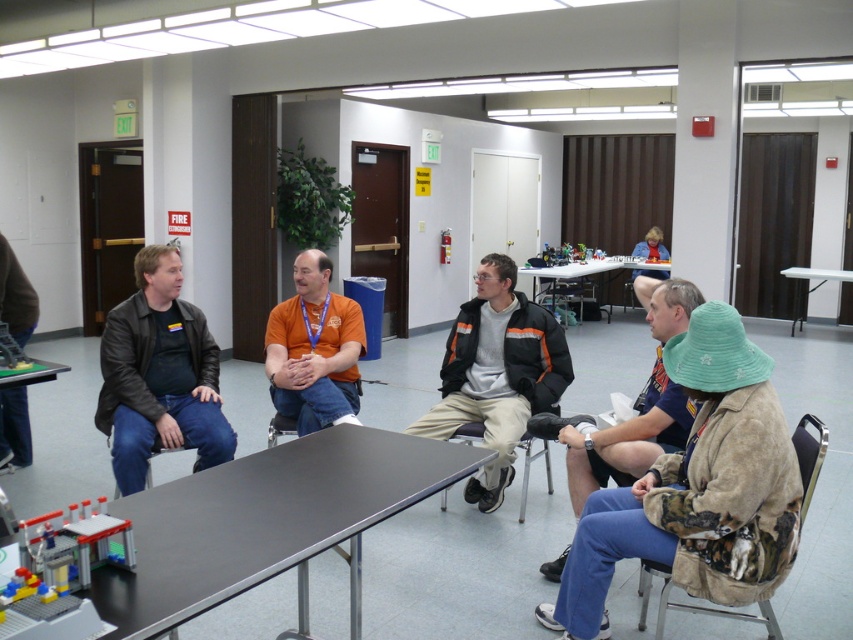
Question: Which object is the farthest from the orange jacket at center?

Choices:
 (A) multicolored plastic toys at center
 (B) translucent plastic toy at lower left
 (C) black fabric chair at center
 (D) white plastic table at right

Answer: (D)

Question: In this image, where is matte plastic chair at center located relative to multicolored plastic toys at center?

Choices:
 (A) below
 (B) above

Answer: (A)

Question: Which of these objects is positioned farthest from the leather jacket at left?

Choices:
 (A) matte plastic chair at lower left
 (B) white plastic table at center

Answer: (B)

Question: Does black metal table at lower left come in front of translucent plastic toy at lower left?

Choices:
 (A) yes
 (B) no

Answer: (A)

Question: Can you confirm if green plastic table at lower left is bigger than multicolored plastic toys at center?

Choices:
 (A) no
 (B) yes

Answer: (A)

Question: Which point appears farthest from the camera in this image?

Choices:
 (A) (804, 272)
 (B) (726, 616)
 (C) (24, 467)

Answer: (A)